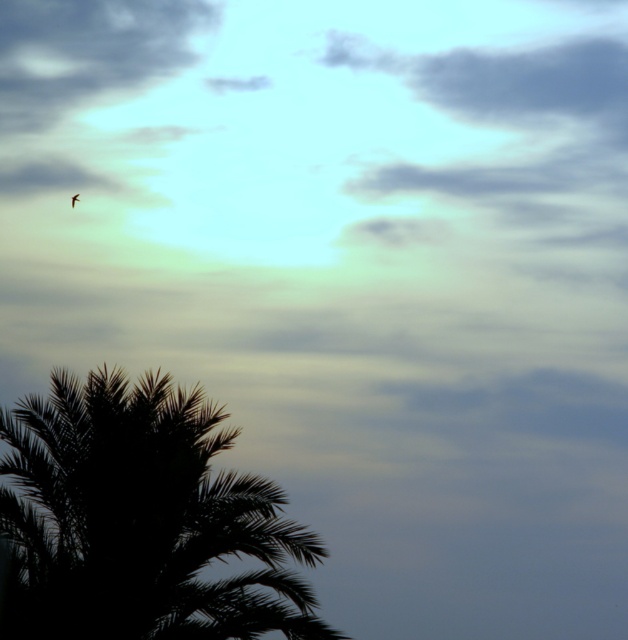
Between black silhouette palm tree at lower left and brown feathered bird at upper left, which one has more height?

black silhouette palm tree at lower left

Where is `black silhouette palm tree at lower left`? black silhouette palm tree at lower left is located at coordinates (141, 518).

Where is `black silhouette palm tree at lower left`? Image resolution: width=628 pixels, height=640 pixels. black silhouette palm tree at lower left is located at coordinates coord(141,518).

Can you confirm if black silhouette palm tree at lower left is positioned to the right of gray fluffy cloud at upper center?

In fact, black silhouette palm tree at lower left is to the left of gray fluffy cloud at upper center.

Is black silhouette palm tree at lower left bigger than gray fluffy cloud at upper center?

Yes.

Is point (134, 410) closer to camera compared to point (625, 76)?

Yes, it is.

The width and height of the screenshot is (628, 640). Find the location of `black silhouette palm tree at lower left`. black silhouette palm tree at lower left is located at coordinates (141, 518).

From the picture: Between gray fluffy cloud at upper center and brown feathered bird at upper left, which one has less height?

brown feathered bird at upper left is shorter.

Consider the image. Is gray fluffy cloud at upper center positioned at the back of brown feathered bird at upper left?

No, it is in front of brown feathered bird at upper left.

Between point (354, 65) and point (72, 204), which one is positioned in front?

Point (72, 204) is more forward.

At what (x,y) coordinates should I click in order to perform the action: click on gray fluffy cloud at upper center. Please return your answer as a coordinate pair (x, y). The width and height of the screenshot is (628, 640). Looking at the image, I should click on (509, 77).